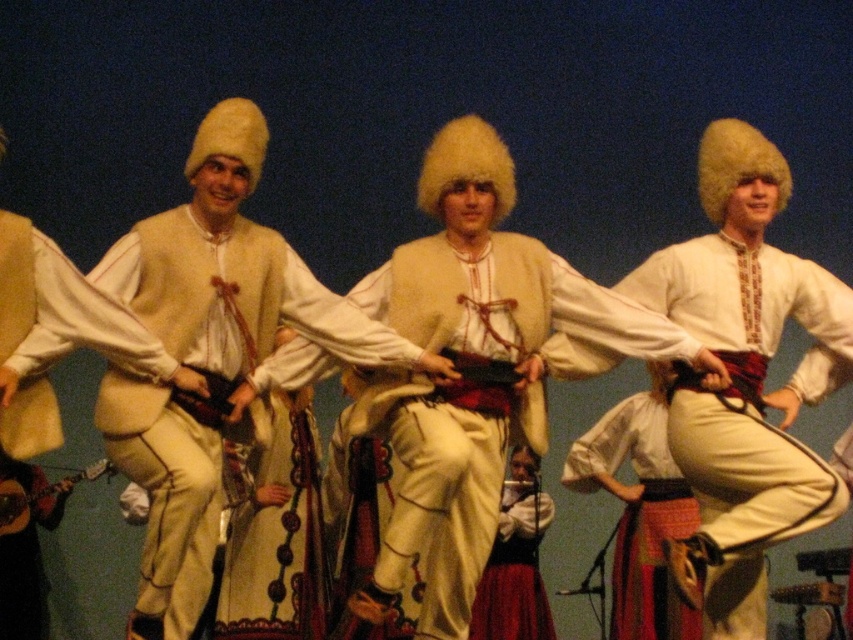
You are a photographer setting up for a cultural dance performance. You need to ensure that the white woolen vest at center and the red velvet skirt at center are both clearly visible in your shot. Based on their sizes, which object should you prioritize focusing on to ensure it doesn not get obscured?

The white woolen vest at center might be wider than red velvet skirt at center, so you should prioritize focusing on the white woolen vest at center to ensure it doesn not get obscured.

You are a photographer trying to capture the performers in the image. You notice the white woolen vest at center and the white woolen hat at center. Which object should you focus on first if you want to ensure the closest item to the camera is in sharp focus?

The white woolen vest at center is closer to the viewer than the white woolen hat at center, so focusing on the white woolen vest at center first will ensure the closest item is in sharp focus.

Looking at this image, you are a photographer setting up for a cultural performance. You notice two white items at the center of the image, the white woolen vest at center and the white woolen hat at center. Which of these items should you focus on if you want to capture the largest object in your frame?

The white woolen vest at center is larger in size than the white woolen hat at center, so focusing on the white woolen vest at center will capture the largest object in the frame.